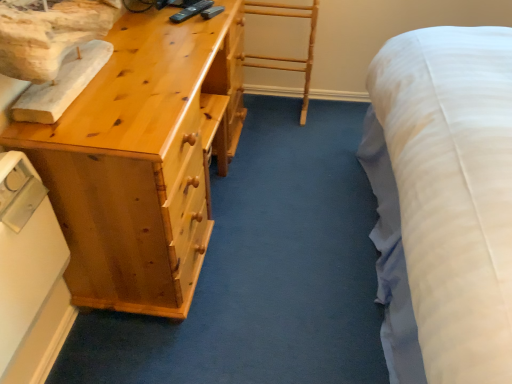
Question: From the image's perspective, would you say white plastic switch at lower left is positioned over light wood chest of drawers at left?

Choices:
 (A) no
 (B) yes

Answer: (A)

Question: Can you confirm if white plastic switch at lower left is positioned to the right of light wood chest of drawers at left?

Choices:
 (A) no
 (B) yes

Answer: (A)

Question: Could you tell me if white plastic switch at lower left is facing light wood chest of drawers at left?

Choices:
 (A) no
 (B) yes

Answer: (A)

Question: From the image's perspective, is white plastic switch at lower left beneath light wood chest of drawers at left?

Choices:
 (A) no
 (B) yes

Answer: (B)

Question: Would you say white plastic switch at lower left is outside light wood chest of drawers at left?

Choices:
 (A) yes
 (B) no

Answer: (A)

Question: Considering the relative positions of white plastic switch at lower left and light wood chest of drawers at left in the image provided, is white plastic switch at lower left behind light wood chest of drawers at left?

Choices:
 (A) yes
 (B) no

Answer: (B)

Question: From the image's perspective, would you say light wood chest of drawers at left is positioned over white plastic switch at lower left?

Choices:
 (A) no
 (B) yes

Answer: (B)

Question: Would you say light wood chest of drawers at left is outside white plastic switch at lower left?

Choices:
 (A) no
 (B) yes

Answer: (B)

Question: Is light wood chest of drawers at left shorter than white plastic switch at lower left?

Choices:
 (A) no
 (B) yes

Answer: (A)

Question: Is light wood chest of drawers at left thinner than white plastic switch at lower left?

Choices:
 (A) no
 (B) yes

Answer: (A)

Question: From the image's perspective, would you say light wood chest of drawers at left is shown under white plastic switch at lower left?

Choices:
 (A) no
 (B) yes

Answer: (A)

Question: Does light wood chest of drawers at left have a larger size compared to white plastic switch at lower left?

Choices:
 (A) yes
 (B) no

Answer: (A)

Question: From the image's perspective, is white plastic switch at lower left located above or below light wood chest of drawers at left?

Choices:
 (A) above
 (B) below

Answer: (B)